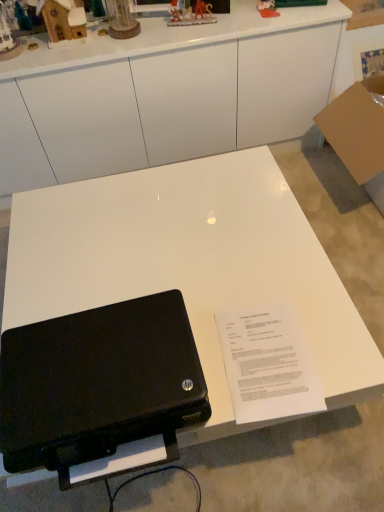
What are the coordinates of `vacant area that lies to the right of wooden house at upper left, which is counted as the second toy, starting from the left` in the screenshot? It's located at (110, 40).